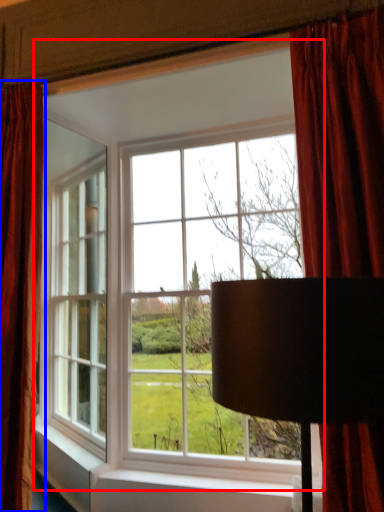
Question: Which of the following is the closest to the observer, window (highlighted by a red box) or curtain (highlighted by a blue box)?

Choices:
 (A) window
 (B) curtain

Answer: (A)